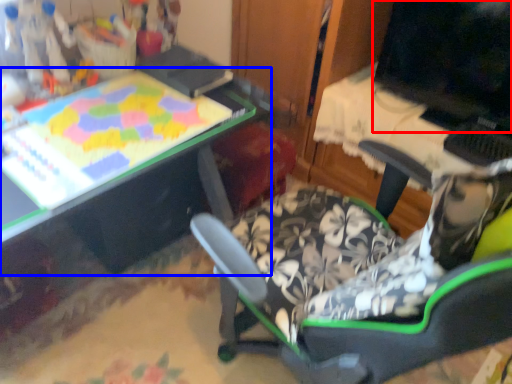
Question: Which object is closer to the camera taking this photo, computer monitor (highlighted by a red box) or table (highlighted by a blue box)?

Choices:
 (A) computer monitor
 (B) table

Answer: (B)